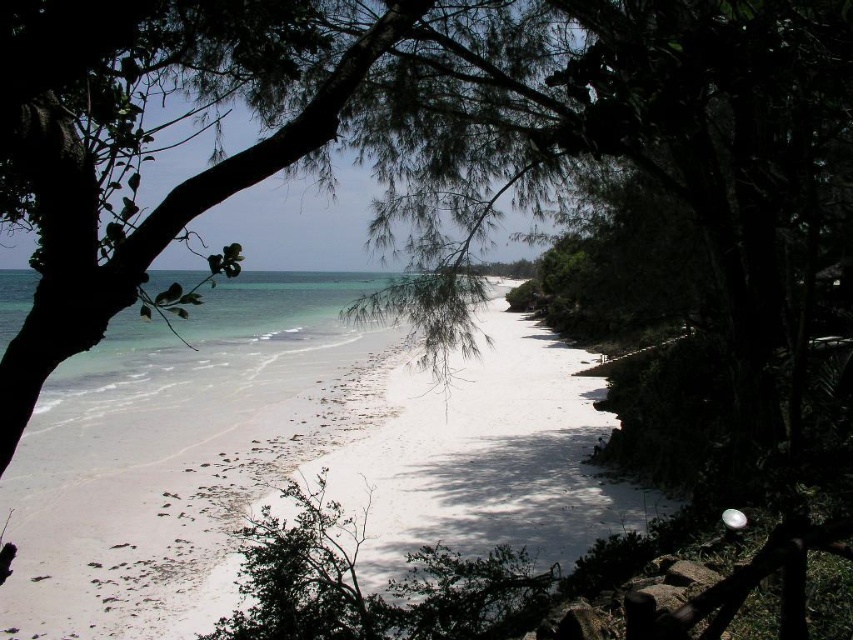
I want to click on white sand beach at center, so click(291, 456).

This screenshot has width=853, height=640. What are the coordinates of `white sand beach at center` in the screenshot? It's located at (291, 456).